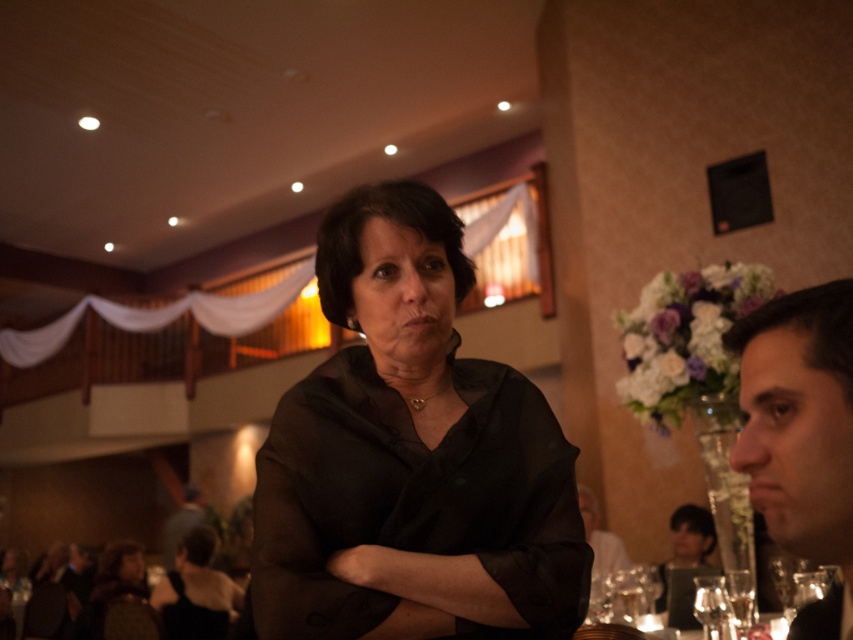
Is point (120, 579) closer to viewer compared to point (712, 538)?

No, it is not.

Find the location of `dark brown fabric at lower left`. dark brown fabric at lower left is located at coordinates (113, 584).

Which is more to the right, matte black blouse at center or matte black dress at center?

matte black dress at center

Is matte black blouse at center positioned in front of matte black dress at center?

Yes, matte black blouse at center is closer to the viewer.

Is point (500, 608) behind point (660, 605)?

No, it is in front of (660, 605).

Locate an element on the screen. The width and height of the screenshot is (853, 640). matte black blouse at center is located at coordinates (410, 456).

Measure the distance from dark brown fabric at lower left to smooth gray shirt at lower left.

dark brown fabric at lower left is 4.78 meters away from smooth gray shirt at lower left.

Does point (125, 600) come farther from viewer compared to point (198, 490)?

No, (125, 600) is in front of (198, 490).

The image size is (853, 640). Identify the location of dark brown fabric at lower left. (113, 584).

Locate an element on the screen. Image resolution: width=853 pixels, height=640 pixels. dark brown fabric at lower left is located at coordinates (113, 584).